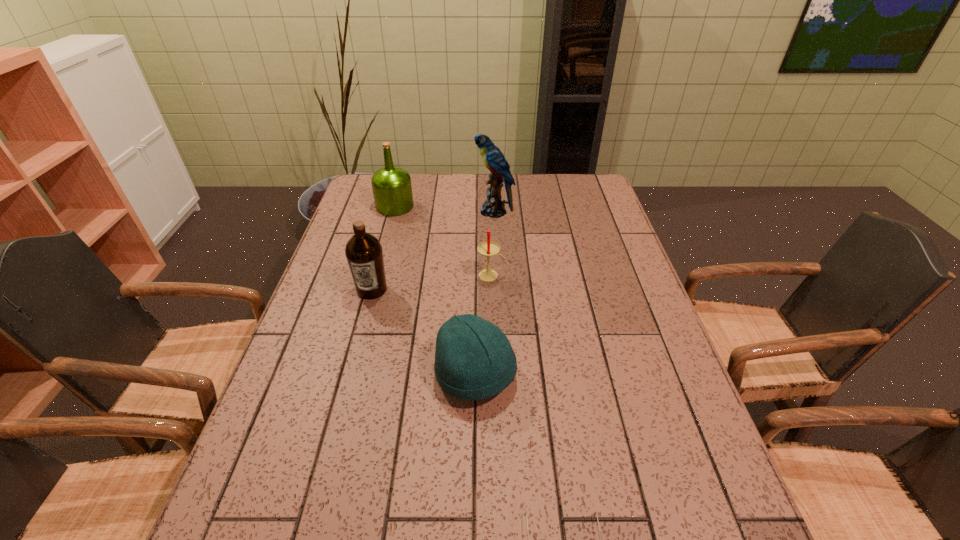
Locate an element on the screen. The height and width of the screenshot is (540, 960). free point between the beanie and the nearer olive oil is located at coordinates (423, 332).

Find the location of a particular element. free space between the beanie and the nearer olive oil is located at coordinates (423, 332).

Where is `vacant space in between the candle and the farther olive oil`? The height and width of the screenshot is (540, 960). vacant space in between the candle and the farther olive oil is located at coordinates (443, 241).

Image resolution: width=960 pixels, height=540 pixels. Identify the location of free space between the parrot and the nearer olive oil. click(433, 251).

Point out which object is positioned as the third nearest to the spectacles. Please provide its 2D coordinates. Your answer should be formatted as a tuple, i.e. [(x, y)], where the tuple contains the x and y coordinates of a point satisfying the conditions above.

[(363, 251)]

Find the location of `object that is the closest to the nearest object`. object that is the closest to the nearest object is located at coordinates (474, 360).

Locate an element on the screen. This screenshot has height=540, width=960. free space that satisfies the following two spatial constraints: 1. on the face of the parrot; 2. on the label of the nearer olive oil is located at coordinates (497, 289).

At what (x,y) coordinates should I click in order to perform the action: click on free space that satisfies the following two spatial constraints: 1. on the front side of the fifth farthest object; 2. on the right side of the farther olive oil. Please return your answer as a coordinate pair (x, y). Looking at the image, I should click on (349, 375).